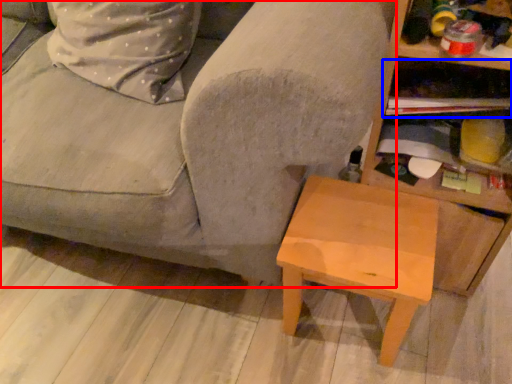
Question: Which of the following is the farthest to the observer, studio couch (highlighted by a red box) or shelf (highlighted by a blue box)?

Choices:
 (A) studio couch
 (B) shelf

Answer: (B)